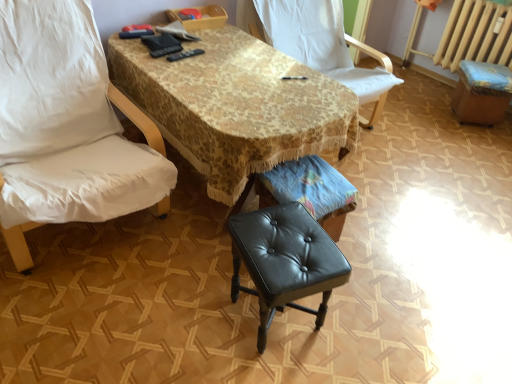
Where is `vacant area located to the right-hand side of white fabric chair at center, the first chair positioned from the right`? The height and width of the screenshot is (384, 512). vacant area located to the right-hand side of white fabric chair at center, the first chair positioned from the right is located at coordinates point(433,139).